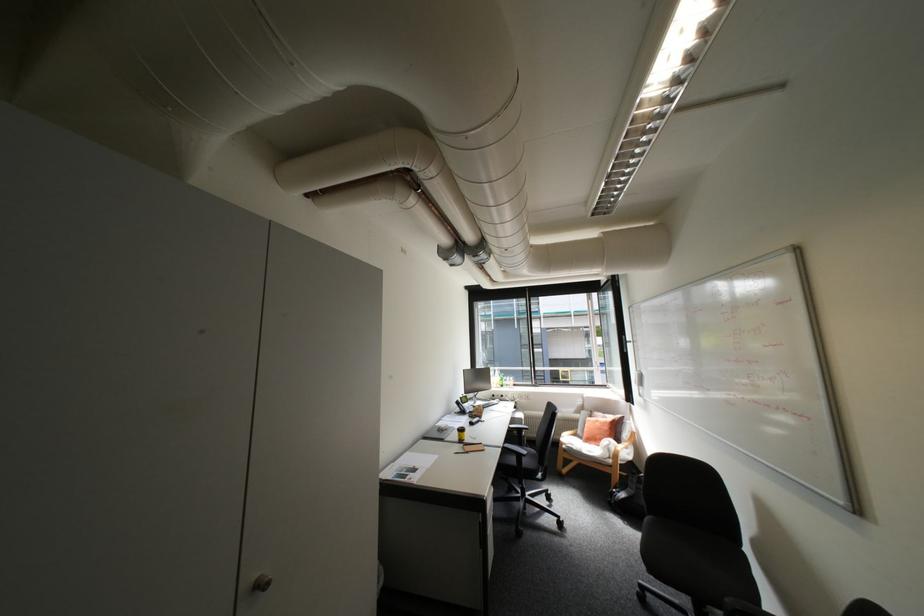
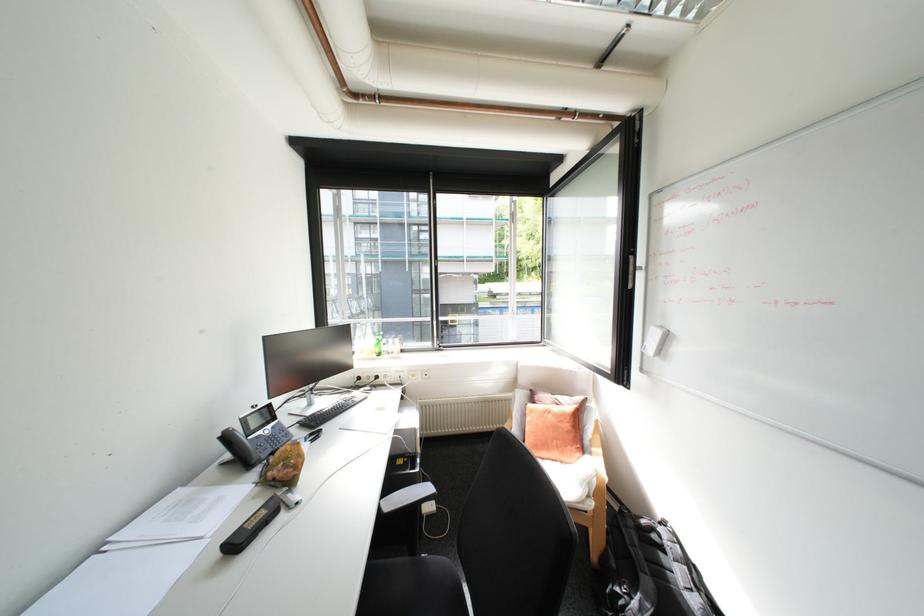
Question: What movement of the cameraman would produce the second image?

Choices:
 (A) Left
 (B) Right
 (C) Forward
 (D) Backward

Answer: (C)